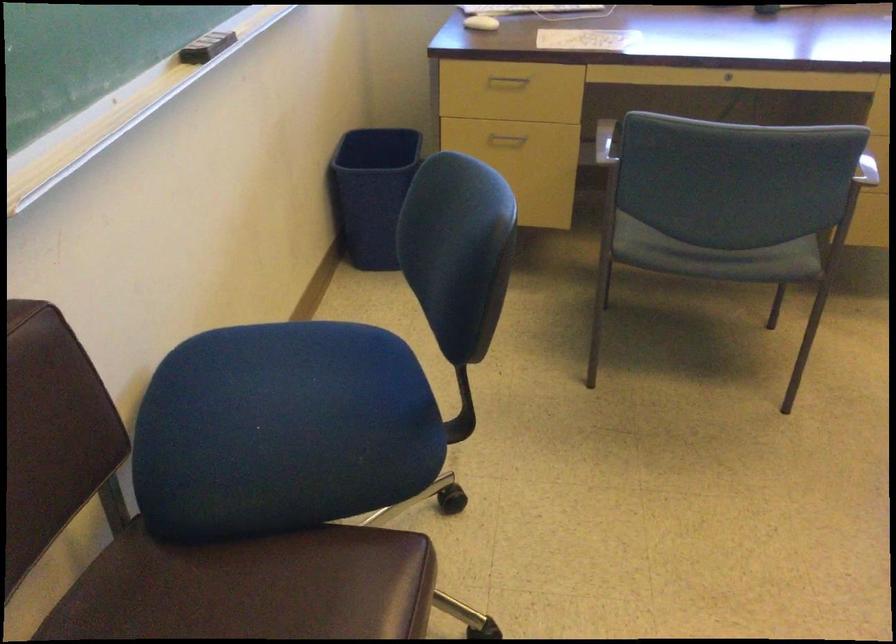
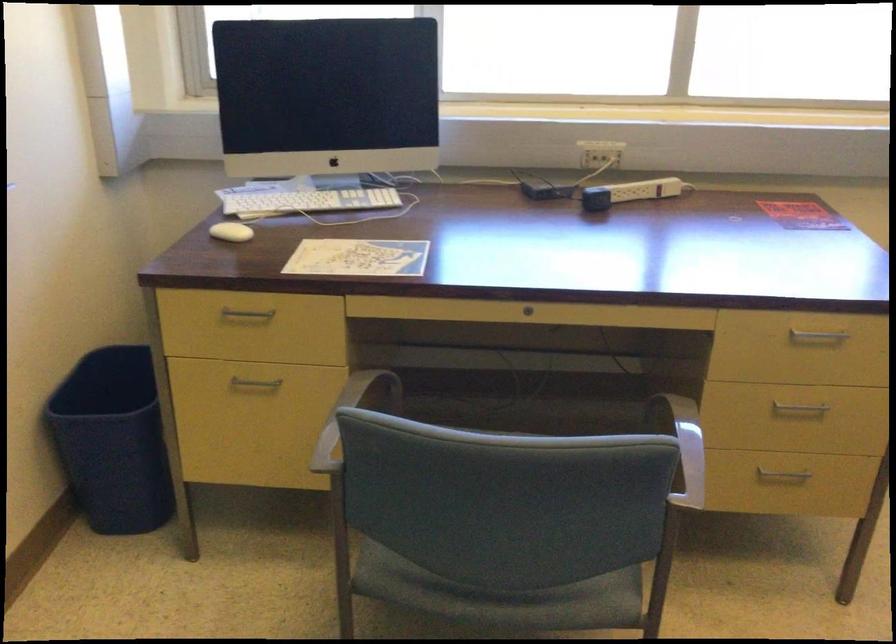
Question: The first image is from the beginning of the video and the second image is from the end. How did the camera likely rotate when shooting the video?

Choices:
 (A) Left
 (B) Right
 (C) Up
 (D) Down

Answer: (C)